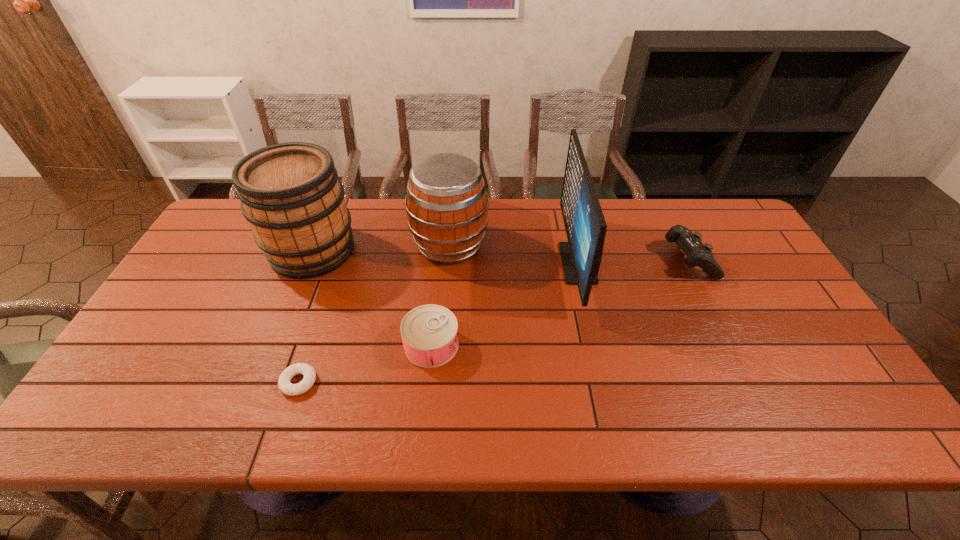
Locate an element on the screen. This screenshot has height=540, width=960. vacant space situated on the left of the right cider is located at coordinates (318, 245).

The height and width of the screenshot is (540, 960). I want to click on free point located on the front of the control, so click(x=705, y=294).

Where is `free point located 0.290m on the left of the can`? free point located 0.290m on the left of the can is located at coordinates (288, 345).

The height and width of the screenshot is (540, 960). In order to click on blank space located on the back of the shortest object in this screenshot , I will do `click(334, 276)`.

At what (x,y) coordinates should I click in order to perform the action: click on computer monitor positioned at the far edge. Please return your answer as a coordinate pair (x, y). Looking at the image, I should click on (585, 225).

Identify the location of control at the far edge. Image resolution: width=960 pixels, height=540 pixels. (698, 254).

Find the location of a particular element. This screenshot has height=540, width=960. object that is at the near edge is located at coordinates (284, 384).

Locate an element on the screen. Image resolution: width=960 pixels, height=540 pixels. object that is at the right edge is located at coordinates (698, 254).

The width and height of the screenshot is (960, 540). Find the location of `object at the far right corner`. object at the far right corner is located at coordinates (698, 254).

This screenshot has height=540, width=960. I want to click on blank space at the far edge of the desktop, so click(620, 215).